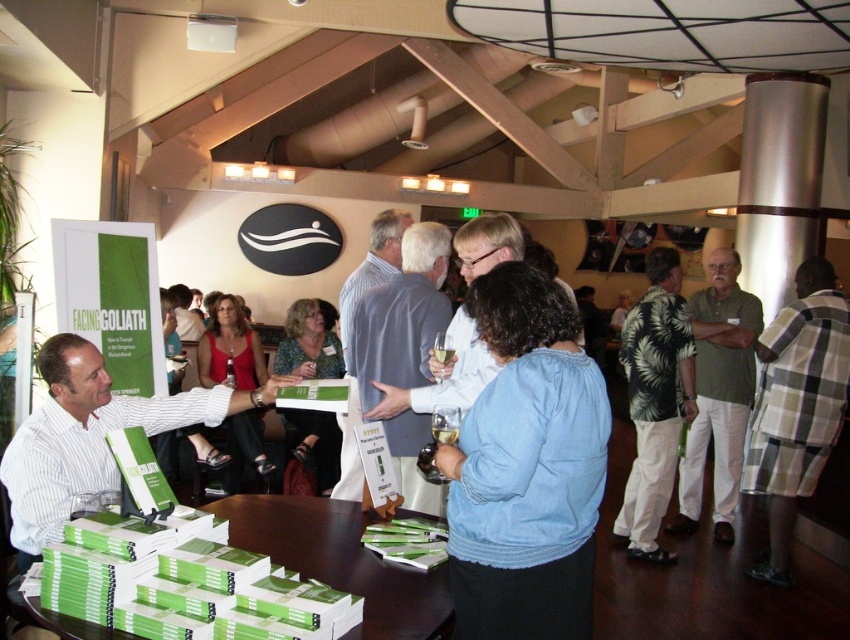
Question: Is green paper book at lower center to the right of blue striped shirt at center from the viewer's perspective?

Choices:
 (A) no
 (B) yes

Answer: (B)

Question: Does plaid shirt at right have a larger size compared to light blue shirt at center?

Choices:
 (A) yes
 (B) no

Answer: (A)

Question: Which point appears farthest from the camera in this image?

Choices:
 (A) (337, 568)
 (B) (830, 417)

Answer: (B)

Question: Which point is farther to the camera?

Choices:
 (A) white striped shirt at left
 (B) blue striped shirt at center

Answer: (B)

Question: Among these points, which one is farthest from the camera?

Choices:
 (A) (765, 410)
 (B) (722, 365)
 (C) (360, 296)
 (D) (52, 374)

Answer: (B)

Question: Does green floral shirt at center have a lesser width compared to blue striped shirt at center?

Choices:
 (A) yes
 (B) no

Answer: (B)